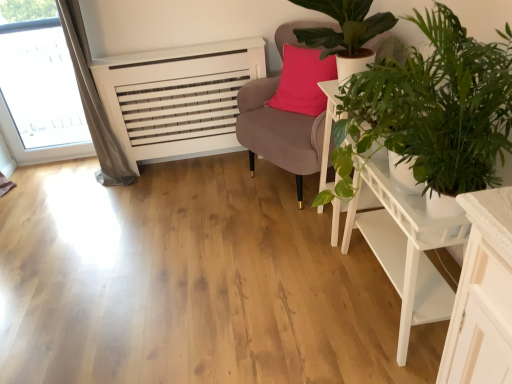
The image size is (512, 384). What are the coordinates of `vacant space in white wooden table at lower right (from a real-world perspective)` in the screenshot? It's located at (382, 296).